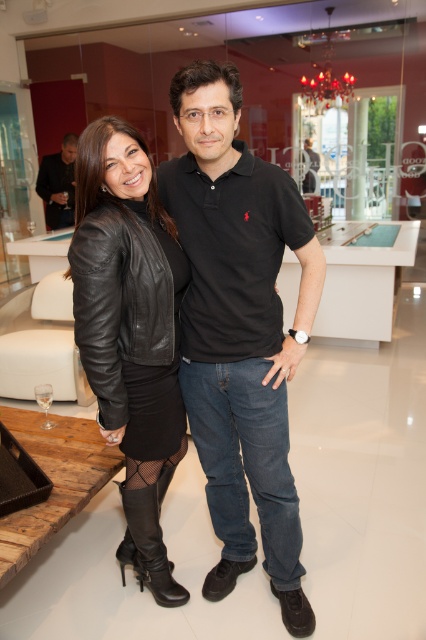
Question: Based on their relative distances, which object is farther from the black leather jacket at left?

Choices:
 (A) black leather jacket at center
 (B) black leather polo shirt at center

Answer: (A)

Question: Does black leather jacket at center have a greater width compared to black leather jacket at left?

Choices:
 (A) yes
 (B) no

Answer: (B)

Question: Which of the following is the farthest from the observer?

Choices:
 (A) black leather jacket at center
 (B) black leather polo shirt at center

Answer: (A)

Question: Estimate the real-world distances between objects in this image. Which object is farther from the black leather polo shirt at center?

Choices:
 (A) black leather jacket at center
 (B) black leather jacket at left

Answer: (B)

Question: Is black leather polo shirt at center below black leather jacket at left?

Choices:
 (A) yes
 (B) no

Answer: (A)

Question: Where is black leather polo shirt at center located in relation to black leather jacket at left in the image?

Choices:
 (A) above
 (B) below

Answer: (B)